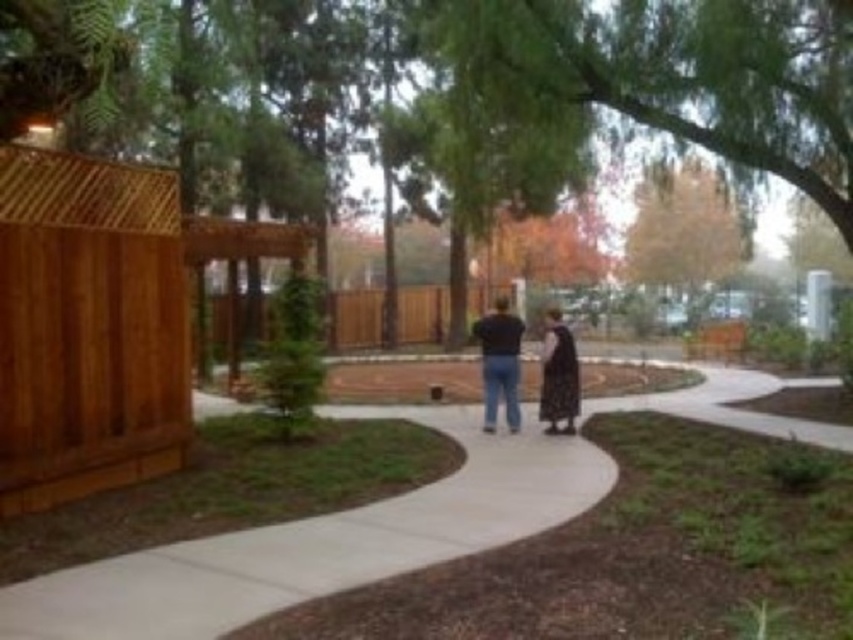
Who is positioned more to the left, yellow-green leaves at upper right or dark gray sweater at center?

dark gray sweater at center

Can you confirm if yellow-green leaves at upper right is taller than dark gray sweater at center?

Correct, yellow-green leaves at upper right is much taller as dark gray sweater at center.

At what (x,y) coordinates should I click in order to perform the action: click on yellow-green leaves at upper right. Please return your answer as a coordinate pair (x, y). The width and height of the screenshot is (853, 640). Looking at the image, I should click on (682, 236).

The height and width of the screenshot is (640, 853). I want to click on yellow-green leaves at upper right, so click(682, 236).

Which is above, dark blue jeans at center or dark gray fabric dress at center?

dark blue jeans at center

Is point (480, 330) closer to viewer compared to point (553, 330)?

That is False.

Between point (508, 324) and point (566, 358), which one is positioned behind?

Positioned behind is point (508, 324).

This screenshot has width=853, height=640. In order to click on dark blue jeans at center in this screenshot , I will do `click(498, 362)`.

Is yellow-green leaves at upper right taller than dark blue jeans at center?

Correct, yellow-green leaves at upper right is much taller as dark blue jeans at center.

Can you confirm if yellow-green leaves at upper right is shorter than dark blue jeans at center?

No, yellow-green leaves at upper right is not shorter than dark blue jeans at center.

Is point (688, 195) in front of point (503, 381)?

No, it is not.

Locate an element on the screen. yellow-green leaves at upper right is located at coordinates (682, 236).